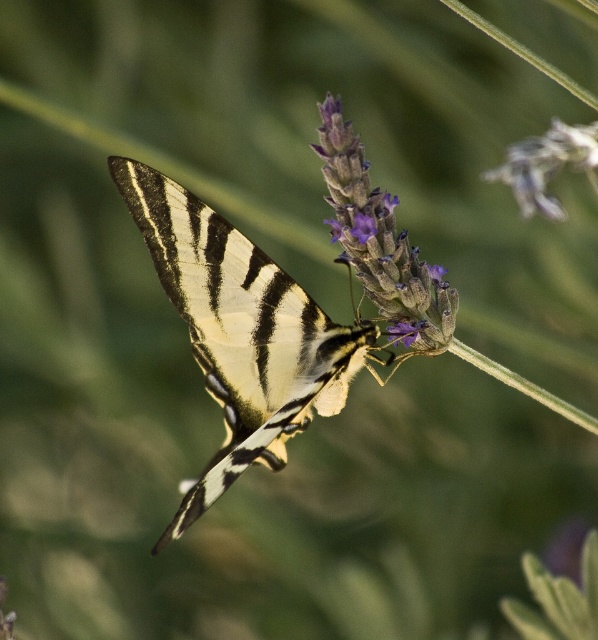
Question: Does shiny gold butterfly at center appear on the left side of purple matte flower at upper center?

Choices:
 (A) no
 (B) yes

Answer: (B)

Question: Which is farther from the shiny gold butterfly at center?

Choices:
 (A) purple matte flower at upper center
 (B) purple fuzzy lavender at center

Answer: (A)

Question: Which point appears farthest from the camera in this image?

Choices:
 (A) (267, 358)
 (B) (547, 141)

Answer: (A)

Question: Estimate the real-world distances between objects in this image. Which object is farther from the purple fuzzy lavender at center?

Choices:
 (A) shiny gold butterfly at center
 (B) purple matte flower at upper center

Answer: (B)

Question: Is purple fuzzy lavender at center wider than purple matte flower at upper center?

Choices:
 (A) yes
 (B) no

Answer: (A)

Question: Is shiny gold butterfly at center positioned at the back of purple matte flower at upper center?

Choices:
 (A) no
 (B) yes

Answer: (B)